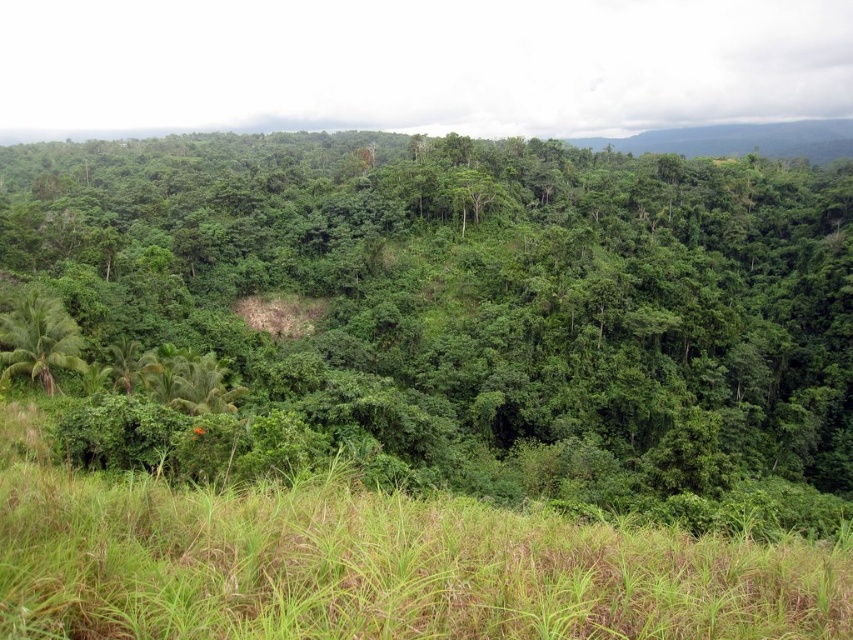
Which of these two, green leafy tree at center or green leafy palm tree at lower left, stands taller?

With more height is green leafy tree at center.

In the scene shown: Who is more distant from viewer, (602, 148) or (18, 336)?

Point (602, 148)

You are a GUI agent. You are given a task and a screenshot of the screen. Output one action in this format:
    pyautogui.click(x=<x>, y=<y>)
    Task: Click on the green leafy tree at center
    
    Given the screenshot: What is the action you would take?
    coord(476,292)

Is green leafy tree at center positioned in front of green grassy field at lower center?

No.

Where is `green leafy tree at center`? The image size is (853, 640). green leafy tree at center is located at coordinates (476, 292).

Can you confirm if green grassy field at lower center is positioned to the left of green leafy palm tree at lower left?

No, green grassy field at lower center is not to the left of green leafy palm tree at lower left.

Can you confirm if green grassy field at lower center is positioned above green leafy palm tree at lower left?

No, green grassy field at lower center is not above green leafy palm tree at lower left.

What do you see at coordinates (373, 564) in the screenshot? I see `green grassy field at lower center` at bounding box center [373, 564].

Locate an element on the screen. The width and height of the screenshot is (853, 640). green grassy field at lower center is located at coordinates (373, 564).